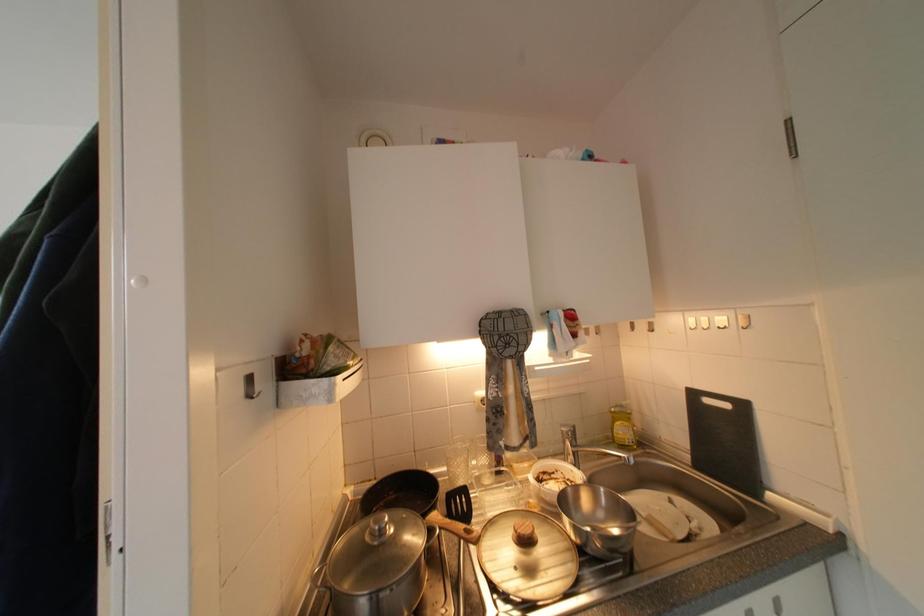
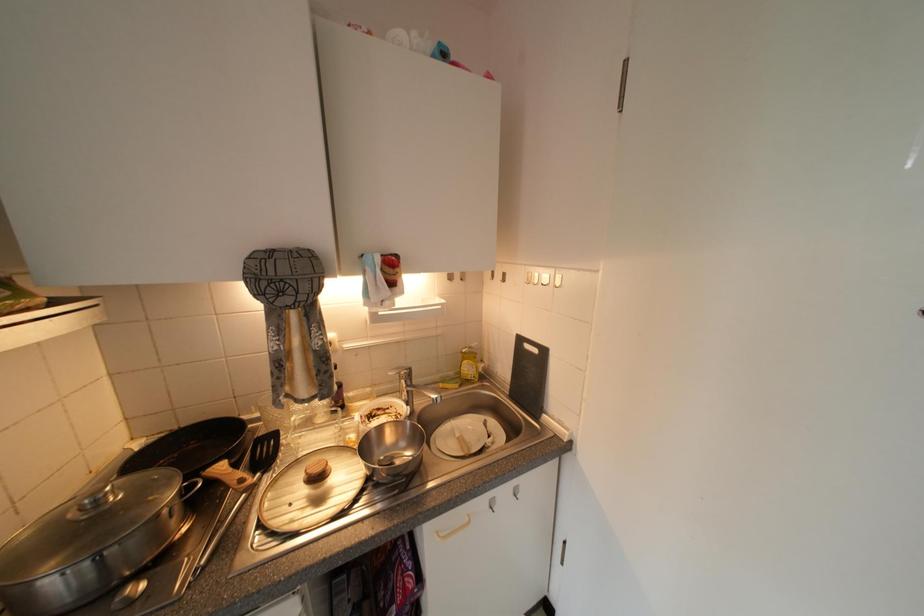
How did the camera likely rotate?

The camera's rotation is toward right-down.